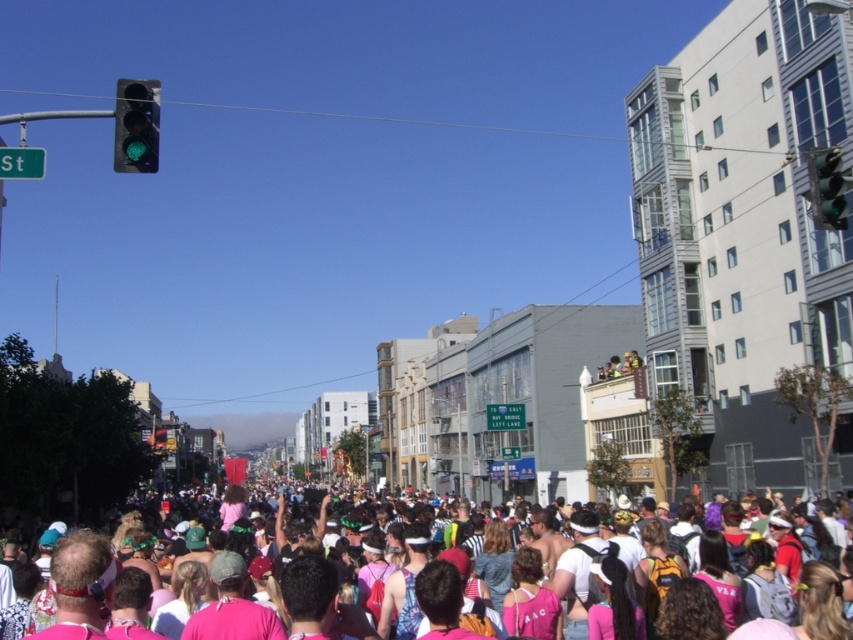
Which is above, green glass traffic light at upper left or pink fabric crowd at center?

green glass traffic light at upper left

Is green glass traffic light at upper left below pink fabric crowd at center?

Incorrect, green glass traffic light at upper left is not positioned below pink fabric crowd at center.

Where is `green glass traffic light at upper left`? Image resolution: width=853 pixels, height=640 pixels. green glass traffic light at upper left is located at coordinates [136, 125].

Who is shorter, green glass traffic light at upper left or green glass traffic light at upper right?

green glass traffic light at upper right

Is the position of green glass traffic light at upper left less distant than that of green glass traffic light at upper right?

Yes, green glass traffic light at upper left is in front of green glass traffic light at upper right.

What do you see at coordinates (136, 125) in the screenshot? The width and height of the screenshot is (853, 640). I see `green glass traffic light at upper left` at bounding box center [136, 125].

Locate an element on the screen. This screenshot has width=853, height=640. green glass traffic light at upper left is located at coordinates (136, 125).

Is point (837, 154) closer to viewer compared to point (560, 538)?

Yes, point (837, 154) is closer to viewer.

Does green glass traffic light at upper right have a smaller size compared to pink fabric crowd at center?

Indeed, green glass traffic light at upper right has a smaller size compared to pink fabric crowd at center.

Does point (830, 173) lie in front of point (593, 596)?

That is True.

In order to click on green glass traffic light at upper right in this screenshot , I will do click(x=827, y=188).